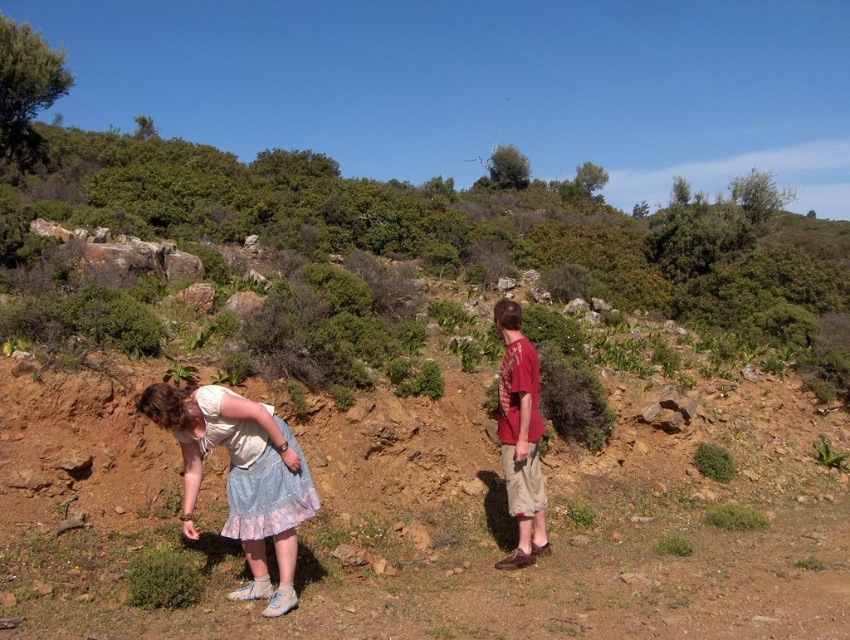
You are a photographer trying to capture a candid shot of the two people in the scene. You want to ensure that both the light blue cotton skirt at lower left and the matte red shirt at center are clearly visible in the frame. Given their sizes, which clothing item might require you to adjust your camera angle to avoid being cropped out?

The light blue cotton skirt at lower left has a larger width than the matte red shirt at center, so it might require adjusting the camera angle to ensure it is fully visible in the frame without being cropped out.

In the scene shown: You are an observer looking at the scene. Where is the light blue cotton skirt at lower left located in terms of coordinates?

The light blue cotton skirt at lower left is located at coordinates point (241, 477).